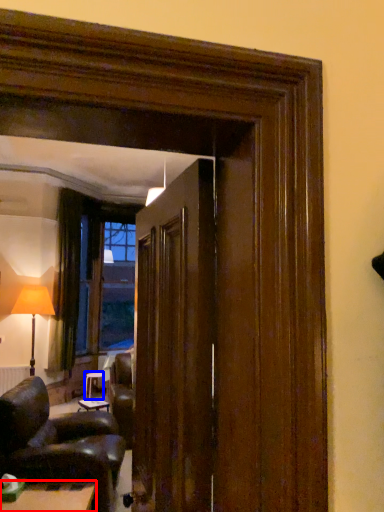
Question: Among these objects, which one is farthest to the camera, table (highlighted by a red box) or table (highlighted by a blue box)?

Choices:
 (A) table
 (B) table

Answer: (B)